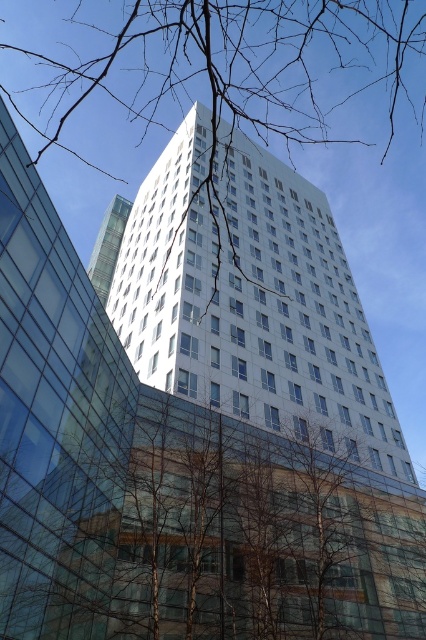
Does white glass building at center have a lesser height compared to transparent glass tower at center?

No, white glass building at center is not shorter than transparent glass tower at center.

Who is positioned more to the left, white glass building at center or transparent glass tower at center?

From the viewer's perspective, transparent glass tower at center appears more on the left side.

Which is behind, point (271, 250) or point (94, 248)?

Positioned behind is point (94, 248).

Find the location of a particular element. The height and width of the screenshot is (640, 426). white glass building at center is located at coordinates 250,300.

Does point (399, 122) come in front of point (5, 269)?

No, (399, 122) is further to viewer.

Which is behind, point (72, 33) or point (23, 608)?

The point (72, 33) is behind.

Where is `bare branches at upper center`? bare branches at upper center is located at coordinates (322, 65).

Can you confirm if white glass building at center is shorter than bare branches at upper center?

Indeed, white glass building at center has a lesser height compared to bare branches at upper center.

Is white glass building at center above bare branches at upper center?

No, white glass building at center is not above bare branches at upper center.

Locate an element on the screen. Image resolution: width=426 pixels, height=640 pixels. white glass building at center is located at coordinates (250, 300).